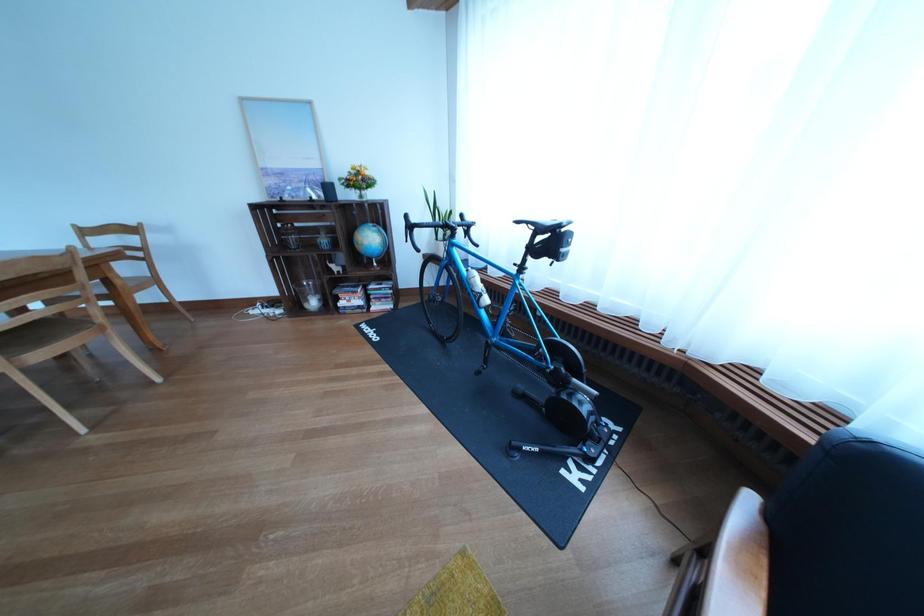
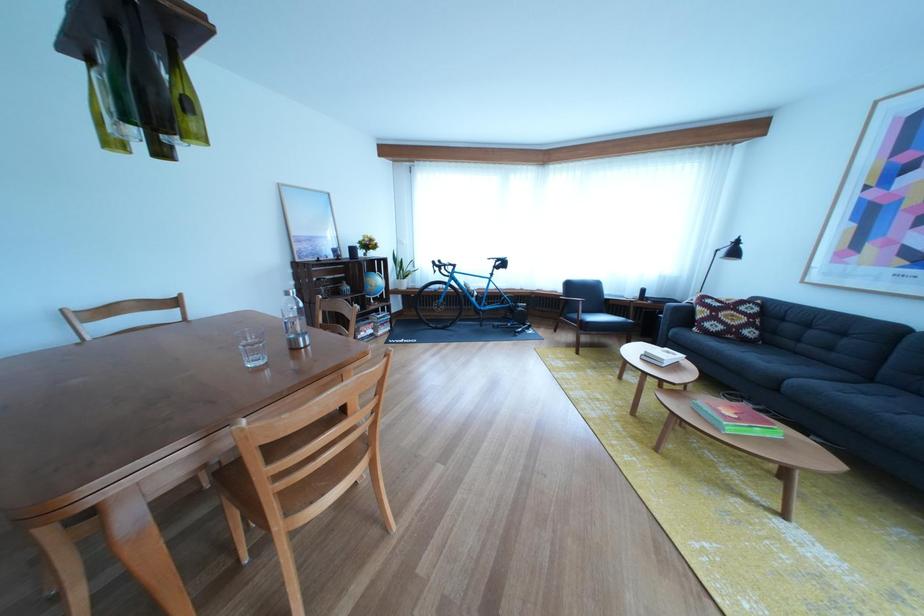
The point at (419, 223) is marked in the first image. Where is the corresponding point in the second image?

(445, 268)